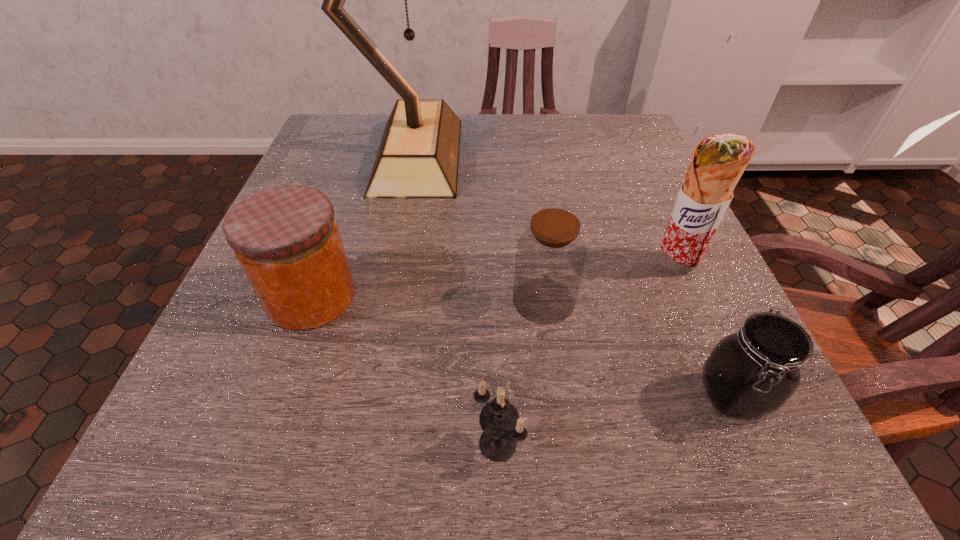
At what (x,y) coordinates should I click in order to perform the action: click on jar that stands as the second closest to the candle holder. Please return your answer as a coordinate pair (x, y). The width and height of the screenshot is (960, 540). Looking at the image, I should click on (286, 239).

Image resolution: width=960 pixels, height=540 pixels. Identify the location of vacant space that satisfies the following two spatial constraints: 1. on the metallic stand of the farthest object; 2. on the right side of the candle holder. (364, 443).

At what (x,y) coordinates should I click in order to perform the action: click on free space that satisfies the following two spatial constraints: 1. on the back side of the leftmost jar; 2. on the left side of the second tallest object. Please return your answer as a coordinate pair (x, y). The height and width of the screenshot is (540, 960). Looking at the image, I should click on (324, 264).

Locate an element on the screen. Image resolution: width=960 pixels, height=540 pixels. free location that satisfies the following two spatial constraints: 1. on the metallic stand of the tallest object; 2. on the right side of the third object from right to left is located at coordinates (391, 300).

The image size is (960, 540). In order to click on free location that satisfies the following two spatial constraints: 1. on the front side of the second jar from left to right; 2. on the right side of the leftmost jar in this screenshot , I will do `click(310, 300)`.

In order to click on blank space that satisfies the following two spatial constraints: 1. on the metallic stand of the tallest object; 2. on the left side of the fifth shortest object in this screenshot , I will do `click(397, 264)`.

At what (x,y) coordinates should I click in order to perform the action: click on vacant area in the image that satisfies the following two spatial constraints: 1. on the back side of the second jar from right to left; 2. on the metallic stand of the table lamp. Please return your answer as a coordinate pair (x, y). The image size is (960, 540). Looking at the image, I should click on (524, 155).

The width and height of the screenshot is (960, 540). In order to click on vacant area in the image that satisfies the following two spatial constraints: 1. on the metallic stand of the table lamp; 2. on the left side of the candle holder in this screenshot , I will do `click(364, 443)`.

Identify the location of free space that satisfies the following two spatial constraints: 1. on the back side of the fifth shortest object; 2. on the left side of the second jar from left to right. This screenshot has width=960, height=540. click(539, 264).

Find the location of a particular element. The width and height of the screenshot is (960, 540). free space that satisfies the following two spatial constraints: 1. on the back side of the candle holder; 2. on the left side of the second jar from left to right is located at coordinates (493, 300).